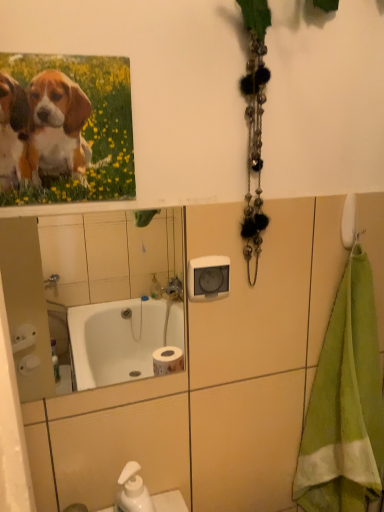
Question: From the image's perspective, relative to green terry cloth towel at right, is white glossy mirror at upper center above or below?

Choices:
 (A) below
 (B) above

Answer: (B)

Question: From a real-world perspective, is white glossy mirror at upper center physically located above or below green terry cloth towel at right?

Choices:
 (A) below
 (B) above

Answer: (B)

Question: Estimate the real-world distances between objects in this image. Which object is farther from the white glossy mirror at upper center?

Choices:
 (A) green terry cloth towel at right
 (B) matte canvas print of puppies at upper left

Answer: (B)

Question: Estimate the real-world distances between objects in this image. Which object is farther from the green terry cloth towel at right?

Choices:
 (A) white glossy mirror at upper center
 (B) matte canvas print of puppies at upper left

Answer: (A)